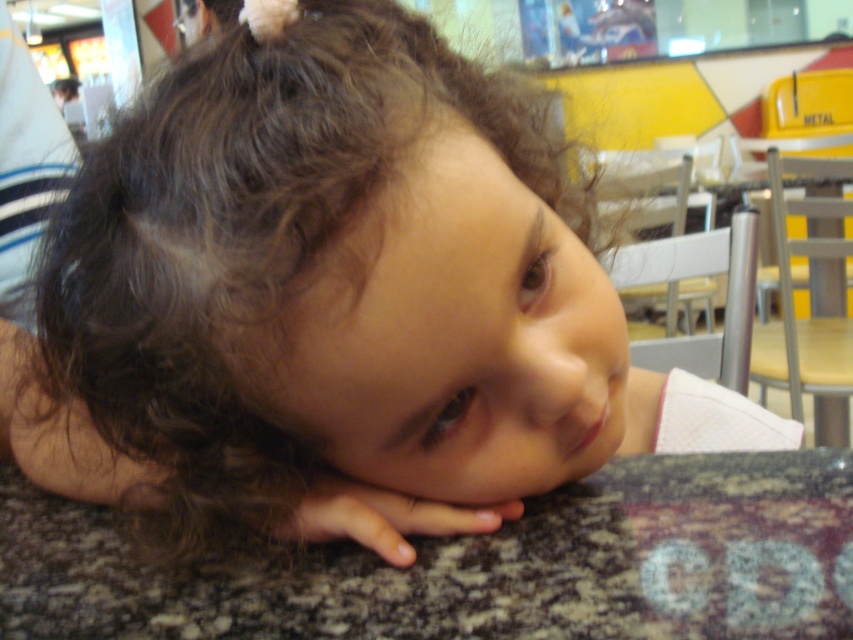
Question: Can you confirm if granite table at lower center is bigger than smooth skin hand at lower center?

Choices:
 (A) yes
 (B) no

Answer: (A)

Question: Does granite table at lower center come in front of smooth skin hand at lower center?

Choices:
 (A) no
 (B) yes

Answer: (B)

Question: In this image, where is granite table at lower center located relative to smooth skin hand at lower center?

Choices:
 (A) below
 (B) above

Answer: (A)

Question: Which point is closer to the camera?

Choices:
 (A) smooth skin hand at lower center
 (B) granite table at lower center

Answer: (B)

Question: Which object is closer to the camera taking this photo?

Choices:
 (A) granite table at lower center
 (B) smooth skin hand at lower center

Answer: (A)

Question: Among these objects, which one is nearest to the camera?

Choices:
 (A) smooth skin hand at lower center
 (B) granite table at lower center

Answer: (B)